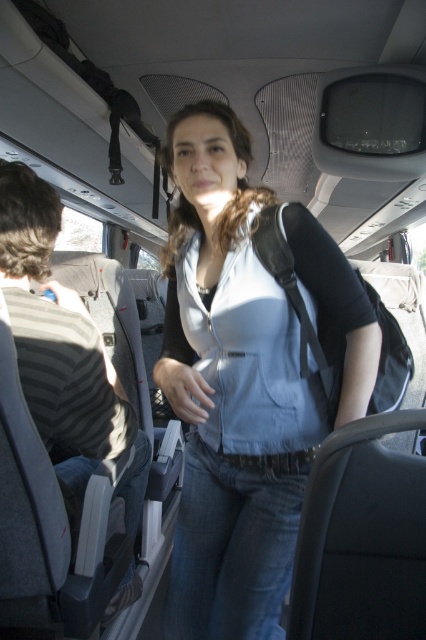
Question: Is matte blue jacket at center below striped fabric shirt at left?

Choices:
 (A) yes
 (B) no

Answer: (B)

Question: Among these objects, which one is nearest to the camera?

Choices:
 (A) matte blue jacket at center
 (B) striped fabric shirt at left

Answer: (A)

Question: Which point appears closest to the camera in this image?

Choices:
 (A) pyautogui.click(x=120, y=604)
 (B) pyautogui.click(x=175, y=218)

Answer: (B)

Question: Observing the image, what is the correct spatial positioning of matte blue jacket at center in reference to striped fabric shirt at left?

Choices:
 (A) right
 (B) left

Answer: (A)

Question: Can you confirm if matte blue jacket at center is positioned above striped fabric shirt at left?

Choices:
 (A) yes
 (B) no

Answer: (A)